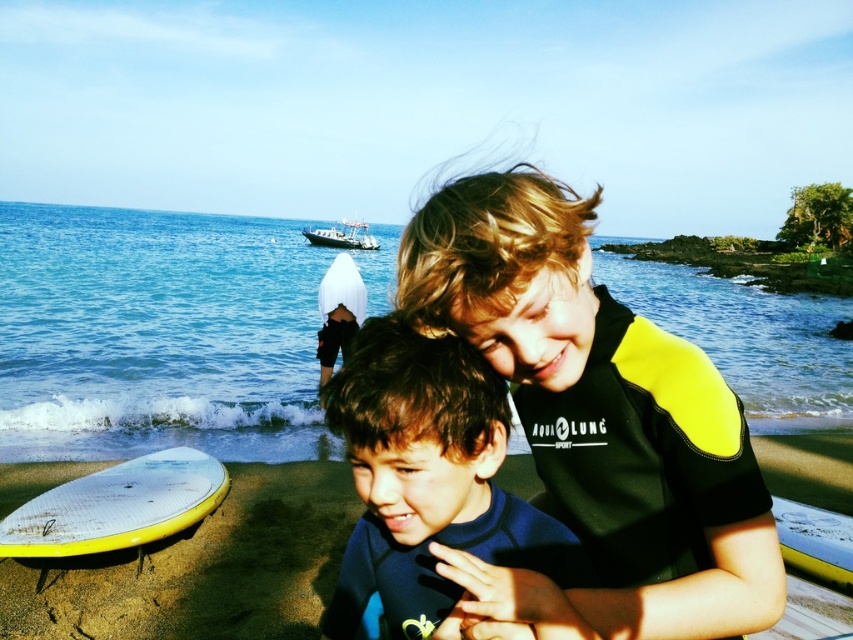
Question: Does blue water at center have a greater width compared to yellow matte surfboard at lower right?

Choices:
 (A) yes
 (B) no

Answer: (A)

Question: Considering the real-world distances, which object is farthest from the white plastic boat at upper center?

Choices:
 (A) black neoprene wetsuit at center
 (B) yellow matte surfboard at lower right

Answer: (A)

Question: Considering the relative positions of yellow matte surfboard at lower left and yellow matte surfboard at lower right in the image provided, where is yellow matte surfboard at lower left located with respect to yellow matte surfboard at lower right?

Choices:
 (A) left
 (B) right

Answer: (A)

Question: In this image, where is black neoprene wetsuit at center located relative to yellow matte surfboard at lower left?

Choices:
 (A) left
 (B) right

Answer: (B)

Question: Which point appears farthest from the camera in this image?

Choices:
 (A) (322, 241)
 (B) (198, 477)
 (C) (502, 240)

Answer: (A)

Question: Which object is the closest to the blue water at center?

Choices:
 (A) blue matte wetsuit at center
 (B) yellow matte surfboard at lower left
 (C) white plastic boat at upper center
 (D) yellow matte surfboard at lower right

Answer: (C)